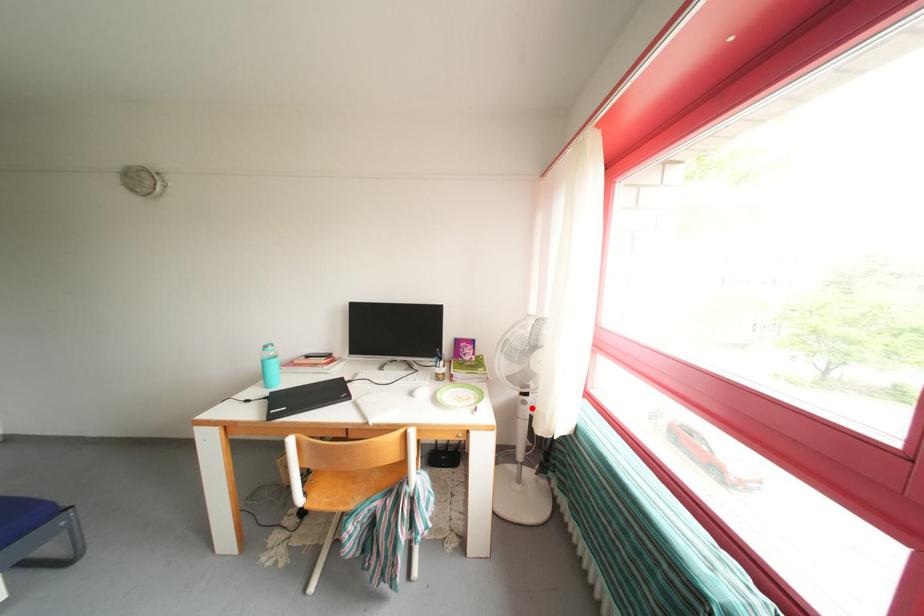
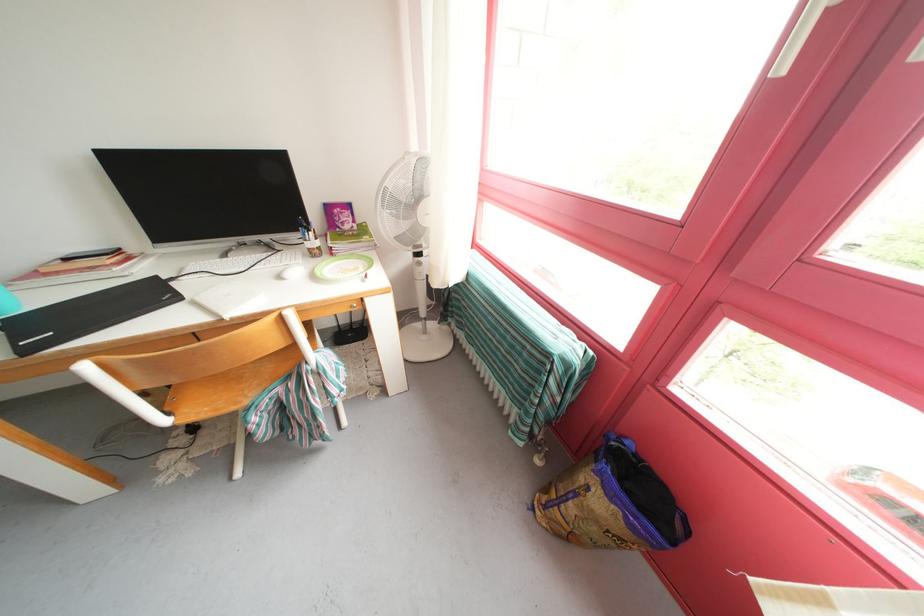
Question: A red point is marked in image1. In image2, is the corresponding 3D point closer to the camera or farther? Reply with the corresponding letter.

Choices:
 (A) The corresponding 3D point is closer.
 (B) The corresponding 3D point is farther.

Answer: (A)